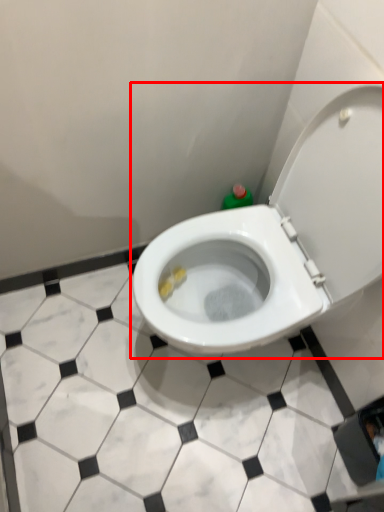
Question: From the image, what is the correct spatial relationship of toilet (annotated by the red box) in relation to tile?

Choices:
 (A) left
 (B) right

Answer: (B)